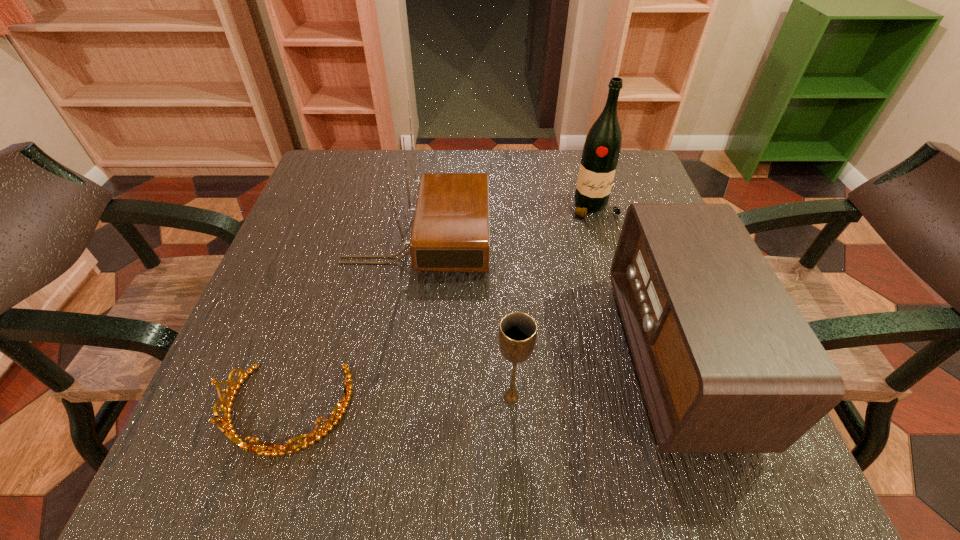
Where is `vacant space that is in between the left radio receiver and the right radio receiver`? This screenshot has width=960, height=540. vacant space that is in between the left radio receiver and the right radio receiver is located at coordinates (546, 297).

The image size is (960, 540). What are the coordinates of `vacant region between the wine bottle and the chalice` in the screenshot? It's located at (553, 302).

The image size is (960, 540). What are the coordinates of `empty location between the fourth shortest object and the shorter radio receiver` in the screenshot? It's located at click(x=546, y=297).

Identify the location of free space between the taller radio receiver and the chalice. The height and width of the screenshot is (540, 960). (465, 318).

Where is `vacant space that's between the right radio receiver and the chalice`? The width and height of the screenshot is (960, 540). vacant space that's between the right radio receiver and the chalice is located at coordinates (593, 376).

The image size is (960, 540). Identify the location of blank region between the shortest object and the chalice. (399, 404).

Identify the location of free point between the tiara and the wine bottle. (441, 309).

Identify the location of vacant space that is in between the wine bottle and the tiara. (441, 309).

The width and height of the screenshot is (960, 540). Find the location of `the fourth closest object to the second tallest object`. the fourth closest object to the second tallest object is located at coordinates (727, 363).

Identify which object is the second closest to the shorter radio receiver. Please provide its 2D coordinates. Your answer should be formatted as a tuple, i.e. [(x, y)], where the tuple contains the x and y coordinates of a point satisfying the conditions above.

[(601, 151)]